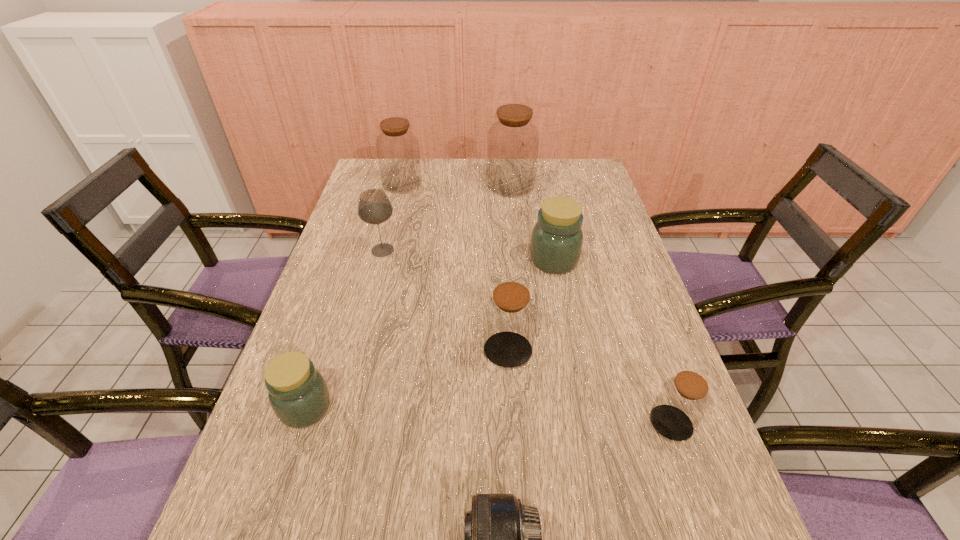
What are the coordinates of `the rightmost jar` in the screenshot? It's located at (683, 400).

Find the location of a particular element. Image resolution: width=960 pixels, height=540 pixels. the left green jar is located at coordinates (298, 394).

Find the location of `the smaller green jar`. the smaller green jar is located at coordinates (298, 394).

In order to click on free spot located 0.220m on the right of the biggest brown jar in this screenshot , I will do `click(596, 185)`.

The height and width of the screenshot is (540, 960). In order to click on vacant space located 0.300m on the front of the seventh shortest object in this screenshot , I will do `click(386, 248)`.

You are a GUI agent. You are given a task and a screenshot of the screen. Output one action in this format:
    pyautogui.click(x=<x>, y=<y>)
    Task: Click on the vacant space located 0.100m on the front of the wineglass
    Image resolution: width=960 pixels, height=540 pixels.
    Given the screenshot: What is the action you would take?
    pyautogui.click(x=373, y=284)

This screenshot has height=540, width=960. I want to click on vacant region located on the left of the farther green jar, so [x=456, y=260].

You are a GUI agent. You are given a task and a screenshot of the screen. Output one action in this format:
    pyautogui.click(x=<x>, y=<y>)
    Task: Click on the free location located on the front of the second nearest brown jar
    
    Given the screenshot: What is the action you would take?
    pyautogui.click(x=513, y=433)

At what (x,y) coordinates should I click in order to perform the action: click on vacant region located 0.140m on the back of the nearest brown jar. Please return your answer as a coordinate pair (x, y). Looking at the image, I should click on (646, 351).

Locate an element on the screen. Image resolution: width=960 pixels, height=540 pixels. vacant space located 0.290m on the back of the nearer green jar is located at coordinates (344, 292).